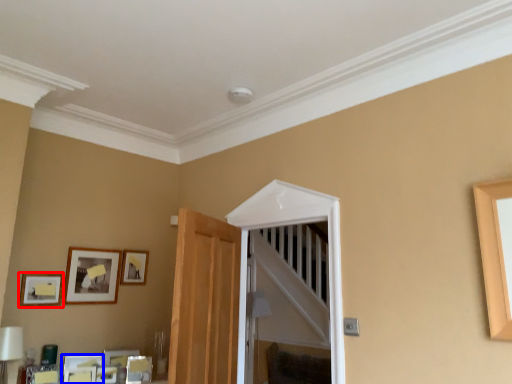
Question: Which point is further to the camera, picture frame (highlighted by a red box) or picture frame (highlighted by a blue box)?

Choices:
 (A) picture frame
 (B) picture frame

Answer: (B)